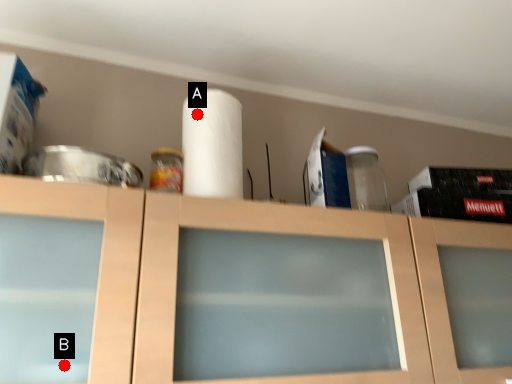
Question: Two points are circled on the image, labeled by A and B beside each circle. Which point is closer to the camera taking this photo?

Choices:
 (A) A is closer
 (B) B is closer

Answer: (B)